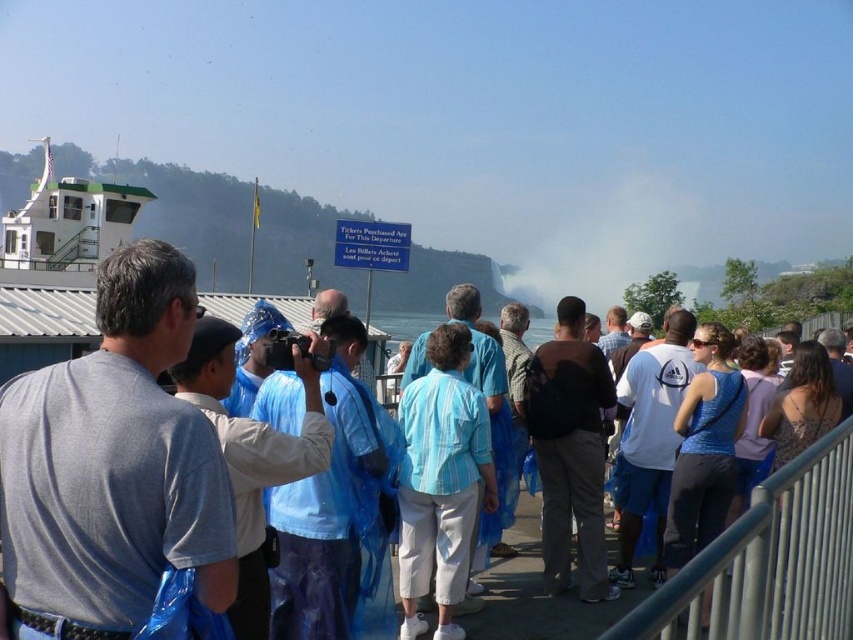
Question: From the image, what is the correct spatial relationship of white mist at center in relation to blue fabric dress at center?

Choices:
 (A) right
 (B) left

Answer: (A)

Question: Which object is the farthest from the silver metallic railing at lower right?

Choices:
 (A) dark brown backpack at center
 (B) light blue striped shirt at center

Answer: (A)

Question: Which of the following is the closest to the observer?

Choices:
 (A) white mist at center
 (B) white glossy boat at upper left
 (C) dark brown backpack at center
 (D) light blue striped shirt at center

Answer: (D)

Question: Does dark brown backpack at center appear on the left side of blue plastic bag at center?

Choices:
 (A) yes
 (B) no

Answer: (B)

Question: Which object is closer to the camera taking this photo?

Choices:
 (A) light blue striped shirt at center
 (B) white mist at center
 (C) white glossy boat at upper left
 (D) silver metallic railing at lower right

Answer: (D)

Question: Can you confirm if light blue striped shirt at center is positioned to the left of blue fabric dress at center?

Choices:
 (A) no
 (B) yes

Answer: (B)